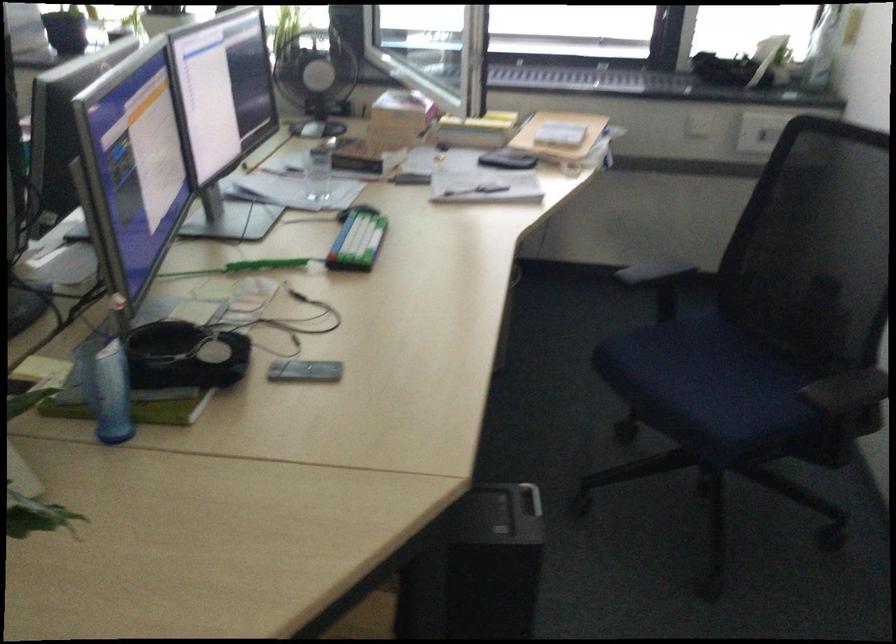
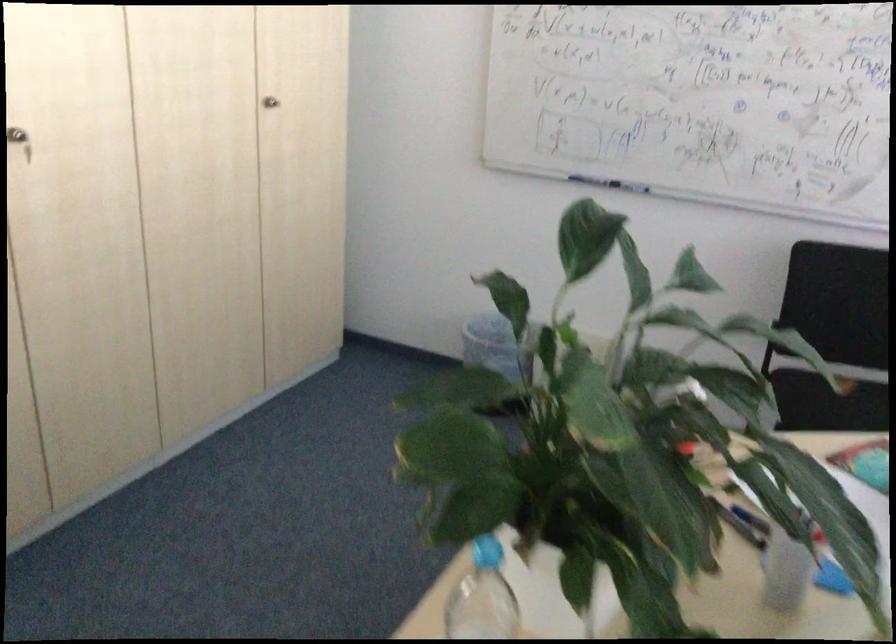
The first image is from the beginning of the video and the second image is from the end. How did the camera likely rotate when shooting the video?

The camera rotated toward left-down.